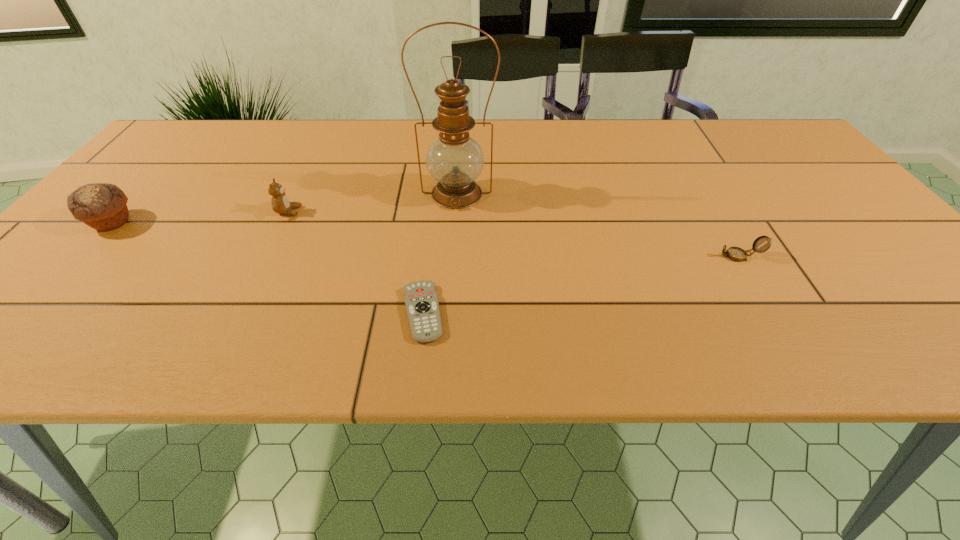
Locate an element on the screen. The width and height of the screenshot is (960, 540). empty location between the nearest object and the teddy bear is located at coordinates (355, 262).

Find the location of a particular element. The width and height of the screenshot is (960, 540). free space between the tallest object and the third tallest object is located at coordinates (372, 202).

Identify which object is the second nearest to the teddy bear. Please provide its 2D coordinates. Your answer should be formatted as a tuple, i.e. [(x, y)], where the tuple contains the x and y coordinates of a point satisfying the conditions above.

[(102, 206)]

In order to click on object that is the third closest to the tallest object in this screenshot , I will do `click(737, 254)`.